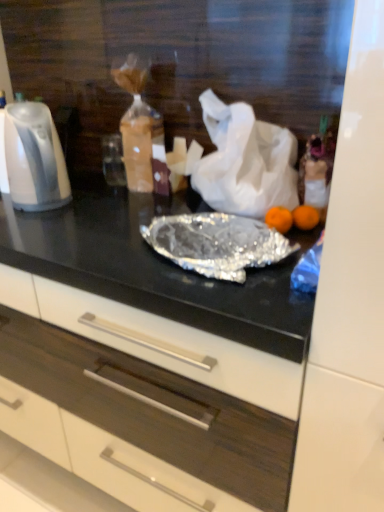
At what (x,y) coordinates should I click in order to perform the action: click on free space in front of white glossy electric kettle at left. Please return your answer as a coordinate pair (x, y). The image size is (384, 512). Looking at the image, I should click on point(29,231).